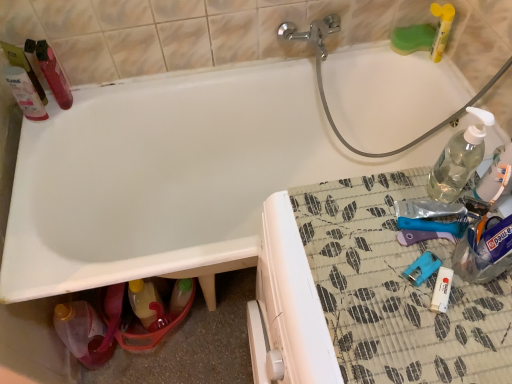
What is the approximate height of clear plastic bottle at upper right, positioned as the second bottle in right-to-left order?

It is 7.70 inches.

In order to face translucent plastic bottle at upper left, which is the 5th bottle from right to left, should I rotate leftwards or rightwards?

To align with it, rotate left about 25.618°.

This screenshot has height=384, width=512. Find the location of `translucent yellow bottle at lower left, which is counted as the 2th bottle, starting from the bottom`. translucent yellow bottle at lower left, which is counted as the 2th bottle, starting from the bottom is located at coordinates (143, 300).

This screenshot has width=512, height=384. What do you see at coordinates (83, 333) in the screenshot?
I see `translucent plastic bottle at lower left, which is the 1th bottle from bottom to top` at bounding box center [83, 333].

Find the location of a particular element. This screenshot has height=384, width=512. clear plastic bottle at upper right, arranged as the 2th bottle when viewed from the top is located at coordinates (459, 159).

Based on their sizes in the image, would you say translucent plastic bottle at upper left, which is the 5th bottle from right to left, is bigger or smaller than clear plastic bottle at upper right, arranged as the 2th bottle when viewed from the top?

Clearly, translucent plastic bottle at upper left, which is the 5th bottle from right to left, is larger in size than clear plastic bottle at upper right, arranged as the 2th bottle when viewed from the top.

Measure the distance from translucent plastic bottle at upper left, placed as the first bottle when sorted from left to right, to clear plastic bottle at upper right, positioned as the second bottle in right-to-left order.

3.56 feet.

Between point (45, 74) and point (450, 163), which one is positioned in front?

Point (450, 163)

Can you tell me how much translucent plastic bottle at upper left, arranged as the 5th bottle when ordered from the bottom, and clear plastic bottle at upper right, positioned as the 4th bottle in bottom-to-top order, differ in facing direction?

147 degrees.

Image resolution: width=512 pixels, height=384 pixels. I want to click on the 3rd bottle located beneath the clear plastic bottle at upper right, the 3th bottle from the bottom (from a real-world perspective), so click(x=143, y=300).

Visually, is clear plastic bottle at upper right, which appears as the 1th bottle when viewed from the right, positioned to the left or to the right of translucent yellow bottle at lower left, which is the third bottle from left to right?

From the image, it's evident that clear plastic bottle at upper right, which appears as the 1th bottle when viewed from the right, is to the right of translucent yellow bottle at lower left, which is the third bottle from left to right.

Is clear plastic bottle at upper right, positioned as the 5th bottle in left-to-right order, shorter than translucent yellow bottle at lower left, the fourth bottle viewed from the top?

Correct, clear plastic bottle at upper right, positioned as the 5th bottle in left-to-right order, is not as tall as translucent yellow bottle at lower left, the fourth bottle viewed from the top.

Looking at this image, is clear plastic bottle at upper right, the 3th bottle from the bottom, surrounding translucent yellow bottle at lower left, which is the 3th bottle from right to left?

No, translucent yellow bottle at lower left, which is the 3th bottle from right to left, is not surrounded by clear plastic bottle at upper right, the 3th bottle from the bottom.

Is point (45, 97) closer to viewer compared to point (496, 173)?

No, (45, 97) is further to viewer.

Is translucent plastic bottles at upper left far away from clear plastic bottle at upper right, the 3th bottle from the bottom?

Yes, translucent plastic bottles at upper left and clear plastic bottle at upper right, the 3th bottle from the bottom, are located far from each other.

From a real-world perspective, is translucent plastic bottles at upper left physically below clear plastic bottle at upper right, which is counted as the third bottle, starting from the top?

Yes, from a real-world perspective, translucent plastic bottles at upper left is beneath clear plastic bottle at upper right, which is counted as the third bottle, starting from the top.

Which is closer to the camera, (x=53, y=64) or (x=144, y=293)?

The point (x=53, y=64) is closer.

Looking at this image, can you see translucent plastic bottle at upper left, arranged as the 1th bottle when viewed from the top, touching translucent yellow bottle at lower left, which is the 3th bottle from right to left?

No.

From the picture: How many degrees apart are the facing directions of translucent plastic bottle at upper left, placed as the first bottle when sorted from left to right, and translucent yellow bottle at lower left, which is counted as the 2th bottle, starting from the bottom?

There is a 92.9-degree angle between the facing directions of translucent plastic bottle at upper left, placed as the first bottle when sorted from left to right, and translucent yellow bottle at lower left, which is counted as the 2th bottle, starting from the bottom.

From their relative heights in the image, would you say translucent plastic bottle at upper left, arranged as the 1th bottle when viewed from the top, is taller or shorter than translucent yellow bottle at lower left, which is the 3th bottle from right to left?

translucent plastic bottle at upper left, arranged as the 1th bottle when viewed from the top, is shorter than translucent yellow bottle at lower left, which is the 3th bottle from right to left.

Which object is positioned more to the left, translucent yellow bottle at lower left, the fourth bottle viewed from the top, or clear plastic bottle at upper right, positioned as the second bottle in right-to-left order?

From the viewer's perspective, translucent yellow bottle at lower left, the fourth bottle viewed from the top, appears more on the left side.

Between point (138, 297) and point (469, 134), which one is positioned in front?

The point (469, 134) is closer.

From a real-world perspective, who is located higher, translucent yellow bottle at lower left, which is the third bottle from left to right, or clear plastic bottle at upper right, positioned as the second bottle in right-to-left order?

clear plastic bottle at upper right, positioned as the second bottle in right-to-left order, from a real-world perspective.

Find the location of a particular element. The image size is (512, 384). the 2nd bottle positioned above the translucent yellow bottle at lower left, the fourth bottle viewed from the top (from a real-world perspective) is located at coordinates (459, 159).

Which bottle is the 3rd one when counting from the right side of the translucent plastic bottle at upper left, arranged as the 5th bottle when ordered from the bottom? Please provide its 2D coordinates.

[(459, 159)]

Could you tell me if clear plastic bottle at upper right, positioned as the second bottle in right-to-left order, is turned towards translucent plastic bottle at upper left, arranged as the 1th bottle when viewed from the top?

Yes, clear plastic bottle at upper right, positioned as the second bottle in right-to-left order, is turned towards translucent plastic bottle at upper left, arranged as the 1th bottle when viewed from the top.

Is clear plastic bottle at upper right, the 4th bottle positioned from the left, closer to the viewer compared to translucent plastic bottle at upper left, arranged as the 5th bottle when ordered from the bottom?

Yes, clear plastic bottle at upper right, the 4th bottle positioned from the left, is closer to the viewer.

Between clear plastic bottle at upper right, arranged as the 2th bottle when viewed from the top, and translucent plastic bottle at upper left, placed as the first bottle when sorted from left to right, which one has larger width?

translucent plastic bottle at upper left, placed as the first bottle when sorted from left to right, is wider.

Based on their positions, is translucent plastic bottle at lower left, which is the 1th bottle from bottom to top, located to the left or right of translucent plastic bottles at upper left?

translucent plastic bottle at lower left, which is the 1th bottle from bottom to top, is to the right of translucent plastic bottles at upper left.

At what (x,y) coordinates should I click in order to perform the action: click on bottle that is the 2nd object to the right of the translucent plastic bottles at upper left, starting at the anchor. Please return your answer as a coordinate pair (x, y). Looking at the image, I should click on coord(83,333).

Can you confirm if translucent plastic bottle at lower left, acting as the second bottle starting from the left, is shorter than translucent plastic bottles at upper left?

Incorrect, the height of translucent plastic bottle at lower left, acting as the second bottle starting from the left, does not fall short of that of translucent plastic bottles at upper left.

Considering the relative sizes of translucent plastic bottle at lower left, the 4th bottle when ordered from right to left, and translucent plastic bottles at upper left in the image provided, is translucent plastic bottle at lower left, the 4th bottle when ordered from right to left, wider than translucent plastic bottles at upper left?

Indeed, translucent plastic bottle at lower left, the 4th bottle when ordered from right to left, has a greater width compared to translucent plastic bottles at upper left.

Where is `bottle above the clear plastic bottle at upper right, arranged as the 2th bottle when viewed from the top (from the image's perspective)`? Image resolution: width=512 pixels, height=384 pixels. bottle above the clear plastic bottle at upper right, arranged as the 2th bottle when viewed from the top (from the image's perspective) is located at coordinates (54, 74).

You are a GUI agent. You are given a task and a screenshot of the screen. Output one action in this format:
    pyautogui.click(x=<x>, y=<y>)
    Task: Click on the 1st bottle below the clear plastic bottle at upper right, which appears as the 1th bottle when viewed from the right (from the image's perspective)
    The height and width of the screenshot is (384, 512).
    Given the screenshot: What is the action you would take?
    pyautogui.click(x=143, y=300)

Which object lies nearer to the anchor point translucent plastic bottle at upper left, placed as the first bottle when sorted from left to right, clear plastic bottle at upper right, arranged as the 2th bottle when viewed from the top, or translucent plastic bottles at upper left?

translucent plastic bottles at upper left is positioned closer to the anchor translucent plastic bottle at upper left, placed as the first bottle when sorted from left to right.

When comparing their distances from translucent yellow bottle at lower left, which is the 3th bottle from right to left, does clear plastic bottle at upper right, arranged as the 2th bottle when viewed from the top, or clear plastic bottle at upper right, which is counted as the third bottle, starting from the top, seem further?

Among the two, clear plastic bottle at upper right, which is counted as the third bottle, starting from the top, is located further to translucent yellow bottle at lower left, which is the 3th bottle from right to left.

In the scene shown: From the image, which object appears to be farther from clear plastic bottle at upper right, which appears as the 1th bottle when viewed from the right, translucent plastic bottle at upper left, arranged as the 1th bottle when viewed from the top, or translucent yellow bottle at lower left, the fourth bottle viewed from the top?

translucent plastic bottle at upper left, arranged as the 1th bottle when viewed from the top.

When comparing their distances from clear plastic bottle at upper right, positioned as the second bottle in right-to-left order, does translucent plastic bottles at upper left or translucent yellow bottle at lower left, which is counted as the 2th bottle, starting from the bottom, seem further?

The object further to clear plastic bottle at upper right, positioned as the second bottle in right-to-left order, is translucent plastic bottles at upper left.

From the image, which object appears to be farther from clear plastic bottle at upper right, which appears as the 1th bottle when viewed from the right, translucent yellow bottle at lower left, which is the 3th bottle from right to left, or translucent plastic bottles at upper left?

translucent plastic bottles at upper left is positioned further to the anchor clear plastic bottle at upper right, which appears as the 1th bottle when viewed from the right.

Based on their spatial positions, is translucent plastic bottles at upper left or translucent plastic bottle at lower left, acting as the second bottle starting from the left, closer to translucent yellow bottle at lower left, which is the third bottle from left to right?

translucent plastic bottle at lower left, acting as the second bottle starting from the left.

Which object lies further to the anchor point translucent plastic bottle at upper left, arranged as the 5th bottle when ordered from the bottom, clear plastic bottle at upper right, which is counted as the third bottle, starting from the top, or translucent yellow bottle at lower left, which is counted as the 2th bottle, starting from the bottom?

clear plastic bottle at upper right, which is counted as the third bottle, starting from the top.

Which object lies nearer to the anchor point translucent yellow bottle at lower left, which is the third bottle from left to right, translucent plastic bottles at upper left or clear plastic bottle at upper right, arranged as the 2th bottle when viewed from the top?

translucent plastic bottles at upper left lies closer to translucent yellow bottle at lower left, which is the third bottle from left to right, than the other object.

Identify the location of cleaning product between translucent plastic bottle at upper left, placed as the first bottle when sorted from left to right, and translucent yellow bottle at lower left, which is the 3th bottle from right to left, in the up-down direction. (24, 83).

I want to click on bottle located between translucent plastic bottle at lower left, the 4th bottle when ordered from right to left, and clear plastic bottle at upper right, the 4th bottle positioned from the left, in the left-right direction, so click(x=143, y=300).

The width and height of the screenshot is (512, 384). Identify the location of cleaning product between translucent plastic bottle at upper left, which is the 5th bottle from right to left, and translucent plastic bottle at lower left, placed as the 5th bottle when sorted from top to bottom, from top to bottom. (24, 83).

Identify the location of bottle between translucent yellow bottle at lower left, which is counted as the 2th bottle, starting from the bottom, and clear plastic bottle at upper right, which appears as the 1th bottle when viewed from the right, from left to right. The height and width of the screenshot is (384, 512). (459, 159).